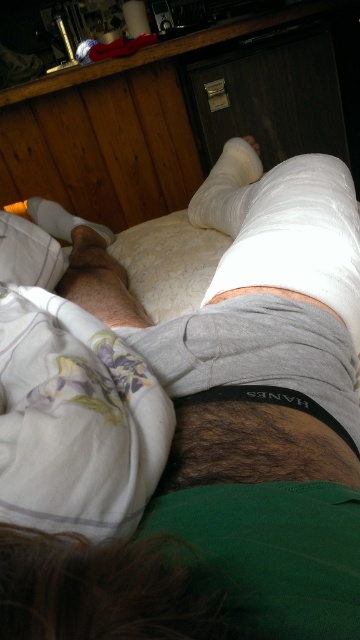
You are a physical therapist assessing the position of the patient in the image. You need to determine the spatial relationship between two points marked on their cast. Are the two points, point (357, 216) and point (38, 198), aligned vertically or horizontally?

The points are not aligned vertically or horizontally. Point (357, 216) is positioned in front of point (38, 198), indicating a spatial relationship where one is closer to the viewer than the other.

You are a nurse checking a patient in the hospital. You need to determine which bandage is wider between the white cloth bandage at center and the white matte bandage at lower left. Which one is wider?

The white matte bandage at lower left is wider than the white cloth bandage at center.